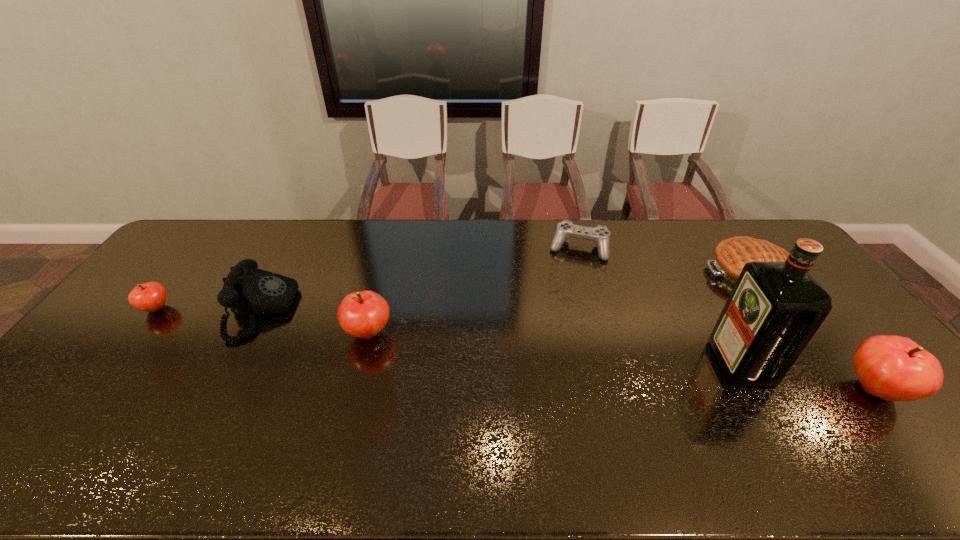
Locate an element on the screen. the leftmost apple is located at coordinates (151, 296).

The width and height of the screenshot is (960, 540). I want to click on the shortest apple, so click(x=151, y=296).

You are a GUI agent. You are given a task and a screenshot of the screen. Output one action in this format:
    pyautogui.click(x=<x>, y=<y>)
    Task: Click on the third tallest object
    The width and height of the screenshot is (960, 540).
    Given the screenshot: What is the action you would take?
    pyautogui.click(x=363, y=314)

Locate an element on the screen. the second apple from left to right is located at coordinates (363, 314).

Locate an element on the screen. The image size is (960, 540). the rightmost apple is located at coordinates 894,368.

Find the location of `the fourth object from right to left`. the fourth object from right to left is located at coordinates (600, 235).

You are a GUI agent. You are given a task and a screenshot of the screen. Output one action in this format:
    pyautogui.click(x=<x>, y=<y>)
    Task: Click on the shortest object
    This screenshot has width=960, height=540.
    Given the screenshot: What is the action you would take?
    pyautogui.click(x=600, y=235)

Locate an element on the screen. Image resolution: width=960 pixels, height=540 pixels. pie is located at coordinates (731, 254).

Find the location of a particular element. The height and width of the screenshot is (540, 960). the tallest object is located at coordinates (775, 308).

Locate an element on the screen. the second object from left to right is located at coordinates (247, 290).